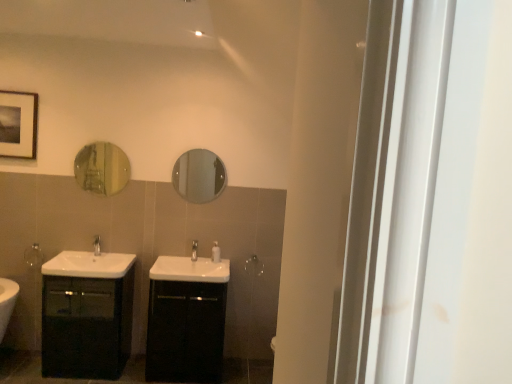
Question: From a real-world perspective, is white glossy soap dispenser at center above or below silver metallic towel bar at center, the second towel bar from the front?

Choices:
 (A) below
 (B) above

Answer: (B)

Question: From the image's perspective, is white glossy soap dispenser at center above or below silver metallic towel bar at center, which ranks as the first towel bar in back-to-front order?

Choices:
 (A) below
 (B) above

Answer: (B)

Question: Based on their relative distances, which object is nearer to the white glossy sink at lower left, placed as the 2th sink when sorted from right to left?

Choices:
 (A) satin nickel faucet at center, which ranks as the 2th tap in left-to-right order
 (B) silver metallic towel bar at center, which ranks as the first towel bar in back-to-front order
 (C) silver metallic towel bar at left, placed as the first towel bar when sorted from left to right
 (D) white glossy soap dispenser at center
 (E) matte black picture frame at upper left

Answer: (C)

Question: Estimate the real-world distances between objects in this image. Which object is closer to the white glossy sink at lower left, arranged as the first sink when viewed from the left?

Choices:
 (A) silver metallic towel bar at center, which ranks as the first towel bar in back-to-front order
 (B) gold reflective mirror at upper left, acting as the 1th mirror starting from the left
 (C) black glossy cabinet at center, which is the second bathroom cabinet from left to right
 (D) matte black cabinet at left, marked as the second bathroom cabinet in a right-to-left arrangement
 (E) silver metallic tap at center, which is the first tap in left-to-right order

Answer: (E)